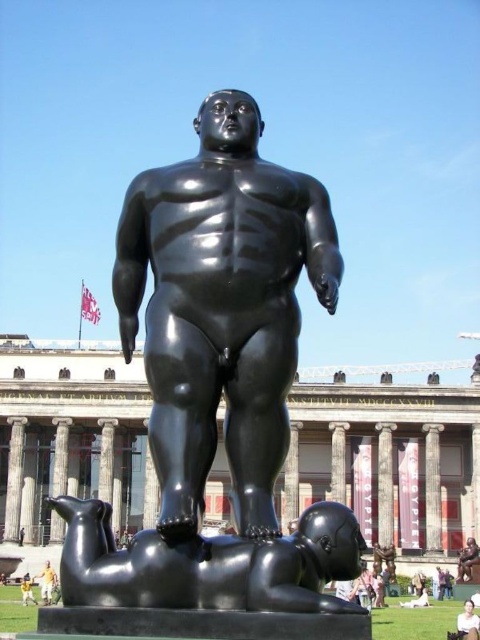
Question: Does smooth stone pillar at center have a larger size compared to yellow fabric person at lower left?

Choices:
 (A) no
 (B) yes

Answer: (B)

Question: Among these objects, which one is nearest to the camera?

Choices:
 (A) smooth stone pillar at center
 (B) smooth skin person at center
 (C) bronze column at center

Answer: (B)

Question: Can you confirm if smooth skin person at center is positioned below yellow fabric person at lower left?

Choices:
 (A) yes
 (B) no

Answer: (B)

Question: Is bronze column at center in front of smooth skin person at center?

Choices:
 (A) no
 (B) yes

Answer: (A)

Question: Among these points, which one is nearest to the camera?

Choices:
 (A) (476, 616)
 (B) (15, 470)

Answer: (A)

Question: Which point appears closest to the camera in this image?

Choices:
 (A) (15, 422)
 (B) (435, 452)

Answer: (B)